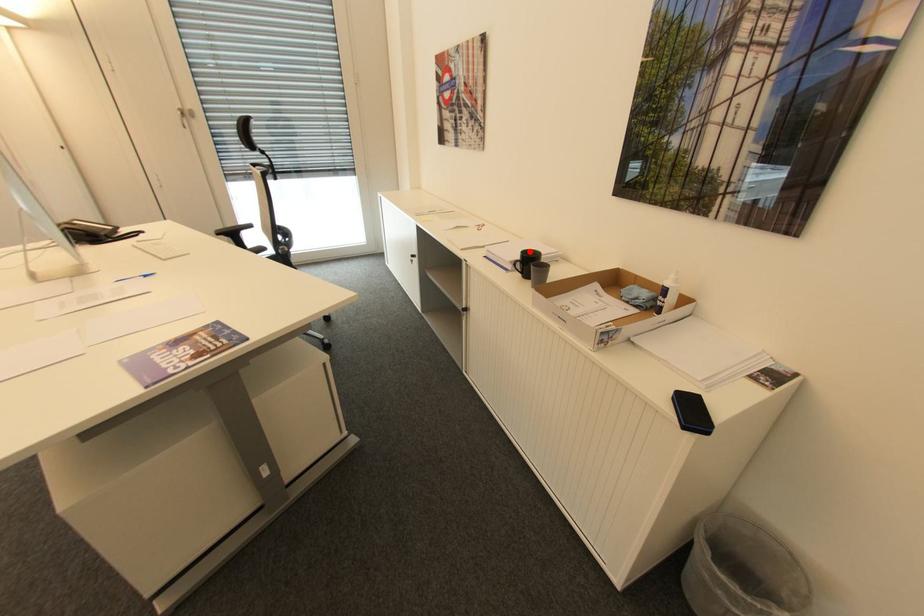
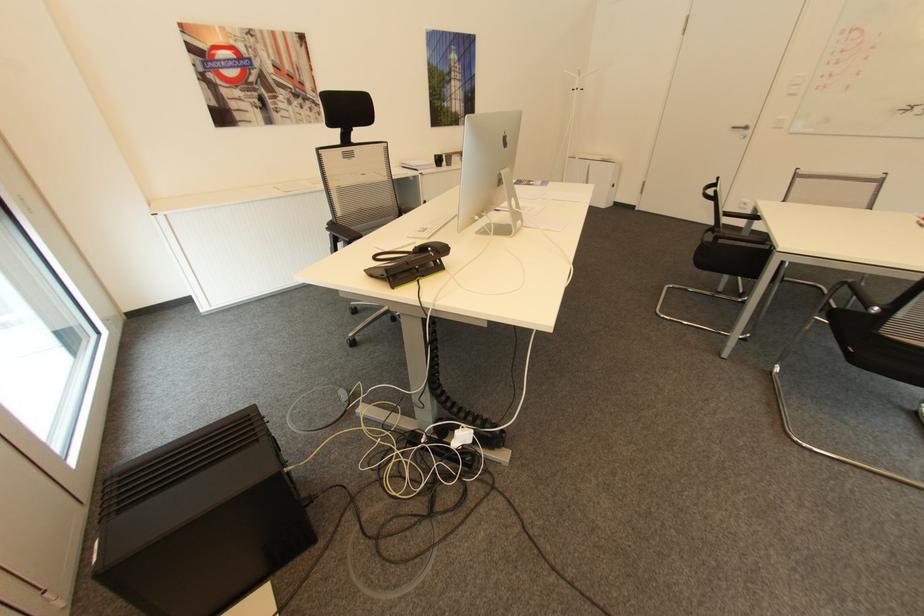
Question: I am providing you with two images of the same scene from different viewpoints. Image1 has a red point marked. In image2, the corresponding 3D location appears at what relative position? Reply with the corresponding letter.

Choices:
 (A) Closer
 (B) Farther

Answer: (A)